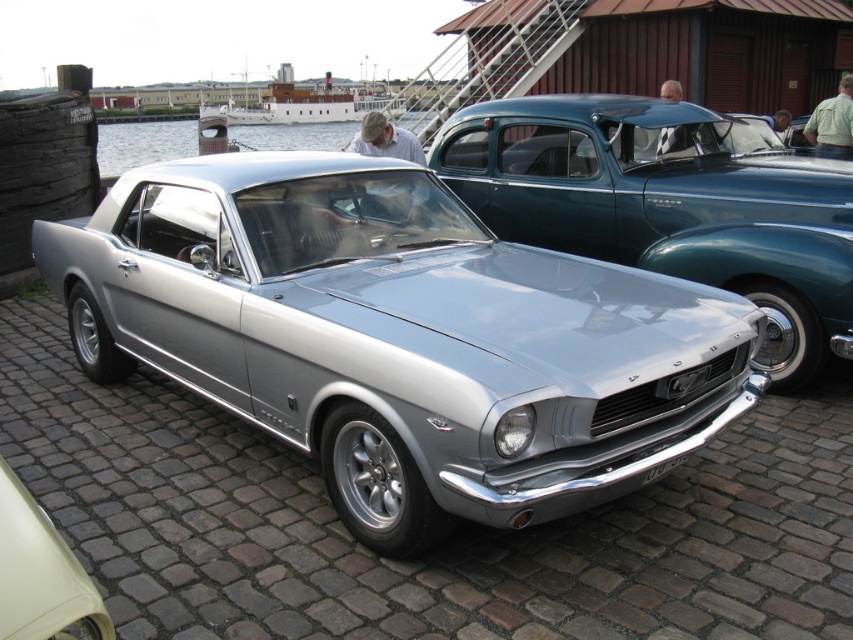
Is silver metallic car at center positioned behind light yellow plastic car at center?

Yes, it is behind light yellow plastic car at center.

Is point (447, 278) positioned behind point (3, 604)?

Yes, point (447, 278) is farther from viewer.

Where is `silver metallic car at center`? silver metallic car at center is located at coordinates (399, 337).

Which of these two, satin silver car at center or white plastic license plate at lower center, stands shorter?

With less height is white plastic license plate at lower center.

Is satin silver car at center taller than white plastic license plate at lower center?

Yes, satin silver car at center is taller than white plastic license plate at lower center.

Is point (743, 266) positioned after point (642, 481)?

Yes.

The height and width of the screenshot is (640, 853). What are the coordinates of `satin silver car at center` in the screenshot? It's located at (669, 205).

Which is in front, point (517, 497) or point (608, 225)?

Point (517, 497) is in front.

Find the location of a particular element. The image size is (853, 640). silver metallic car at center is located at coordinates pyautogui.click(x=399, y=337).